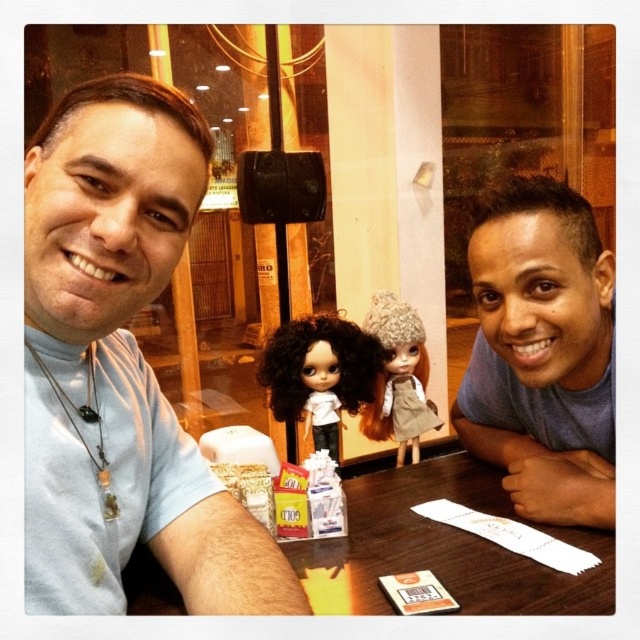
Question: Does curly-haired doll at center appear under fuzzy beige hat at center?

Choices:
 (A) no
 (B) yes

Answer: (A)

Question: Is light blue t-shirt at left positioned before fuzzy beige hat at center?

Choices:
 (A) yes
 (B) no

Answer: (A)

Question: Which point is farther to the camera?

Choices:
 (A) (314, 378)
 (B) (211, 486)
 (C) (595, 461)

Answer: (A)

Question: Among these objects, which one is farthest from the camera?

Choices:
 (A) curly-haired doll at center
 (B) gray matte shirt at upper right
 (C) light blue t-shirt at left

Answer: (A)

Question: Which object is closer to the camera taking this photo?

Choices:
 (A) fuzzy beige hat at center
 (B) light blue t-shirt at left
 (C) gray matte shirt at upper right
 (D) curly-haired doll at center

Answer: (B)

Question: Does gray matte shirt at upper right appear on the left side of fuzzy beige hat at center?

Choices:
 (A) yes
 (B) no

Answer: (B)